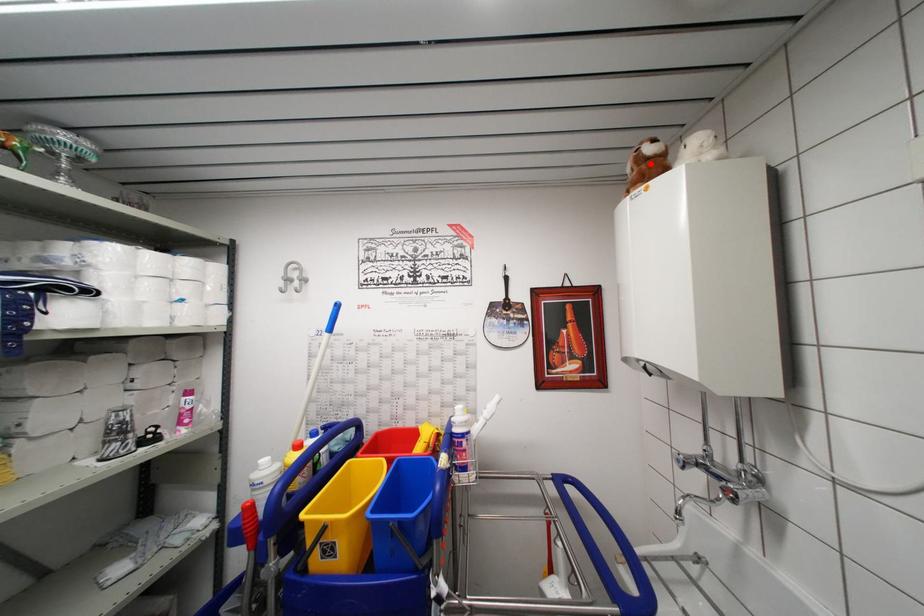
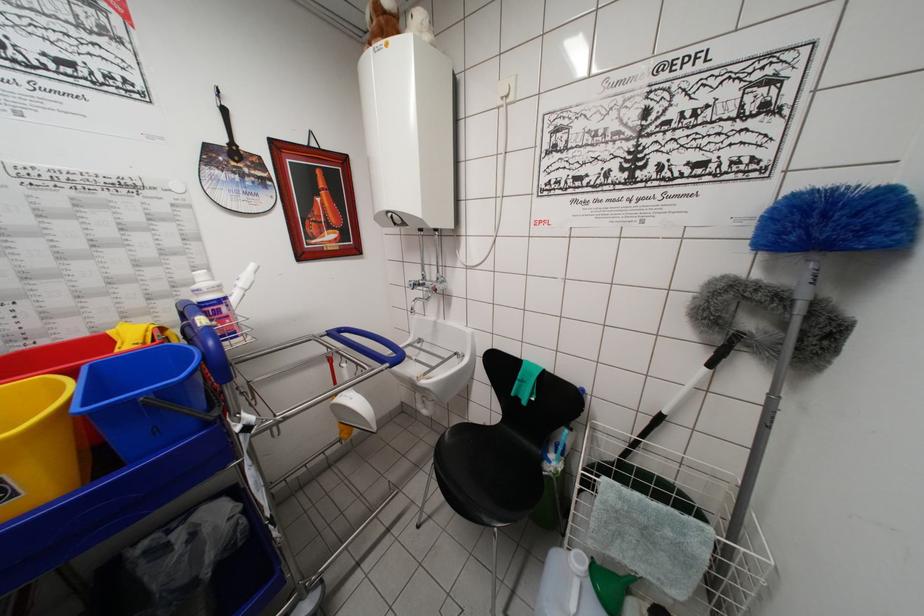
Where in the second image is the point corresponding to the highlighted location from the first image?

(387, 17)